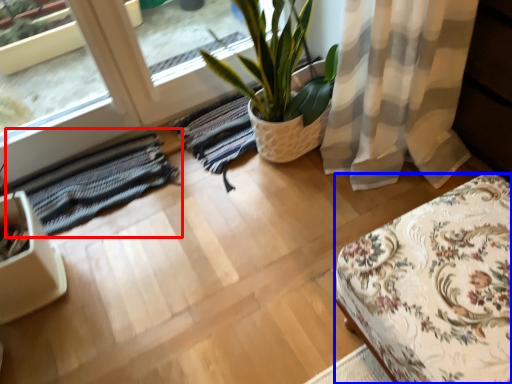
Question: Which object is closer to the camera taking this photo, mat (highlighted by a red box) or furniture (highlighted by a blue box)?

Choices:
 (A) mat
 (B) furniture

Answer: (B)